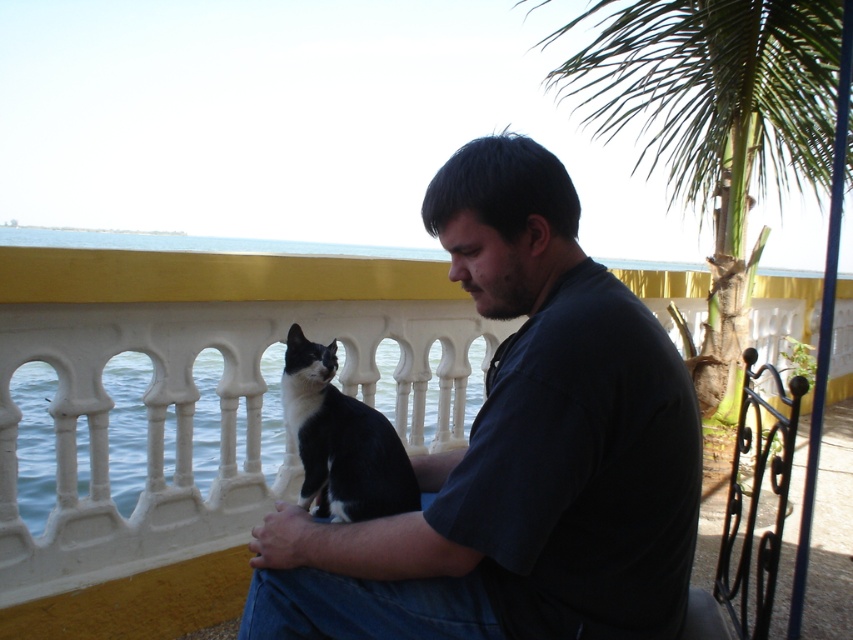
Question: Among these objects, which one is nearest to the camera?

Choices:
 (A) dark blue shirt at center
 (B) green leafy palm tree at upper right
 (C) black fur cat at center

Answer: (A)

Question: Which object is the closest to the green leafy palm tree at upper right?

Choices:
 (A) dark blue shirt at center
 (B) black fur cat at center

Answer: (B)

Question: Can you confirm if dark blue shirt at center is positioned below green leafy palm tree at upper right?

Choices:
 (A) no
 (B) yes

Answer: (B)

Question: Which point appears closest to the camera in this image?

Choices:
 (A) (341, 561)
 (B) (729, 202)
 (C) (363, 449)

Answer: (A)

Question: Observing the image, what is the correct spatial positioning of dark blue shirt at center in reference to black fur cat at center?

Choices:
 (A) below
 (B) above

Answer: (B)

Question: Can you confirm if dark blue shirt at center is wider than green leafy palm tree at upper right?

Choices:
 (A) yes
 (B) no

Answer: (B)